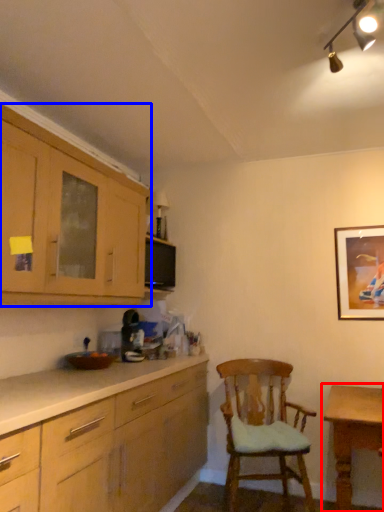
Question: Among these objects, which one is nearest to the camera, table (highlighted by a red box) or cabinetry (highlighted by a blue box)?

Choices:
 (A) table
 (B) cabinetry

Answer: (B)